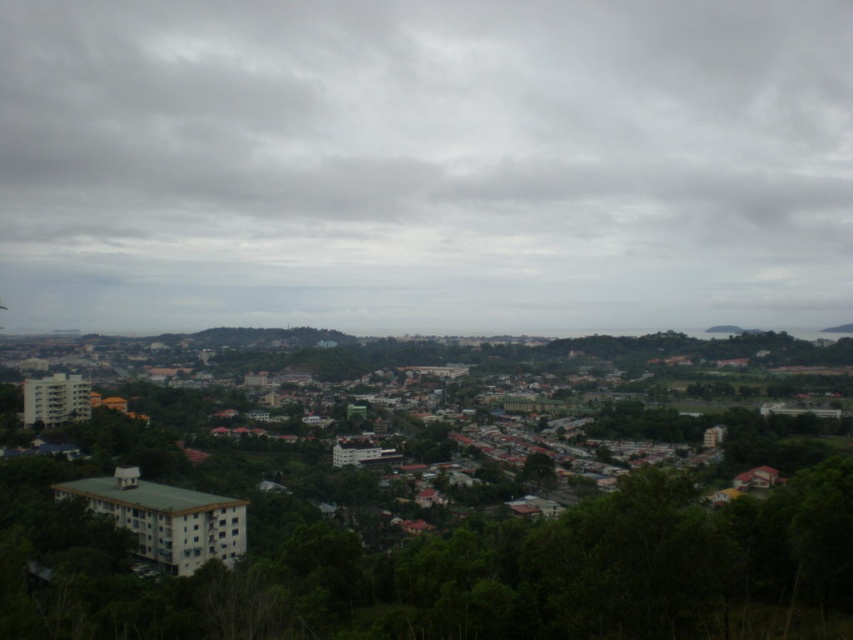
Which is above, gray cloudy sky at upper center or green leafy tree at center?

gray cloudy sky at upper center

Does gray cloudy sky at upper center come in front of green leafy tree at center?

That is False.

This screenshot has height=640, width=853. Describe the element at coordinates (426, 164) in the screenshot. I see `gray cloudy sky at upper center` at that location.

At what (x,y) coordinates should I click in order to perform the action: click on gray cloudy sky at upper center. Please return your answer as a coordinate pair (x, y). Looking at the image, I should click on (426, 164).